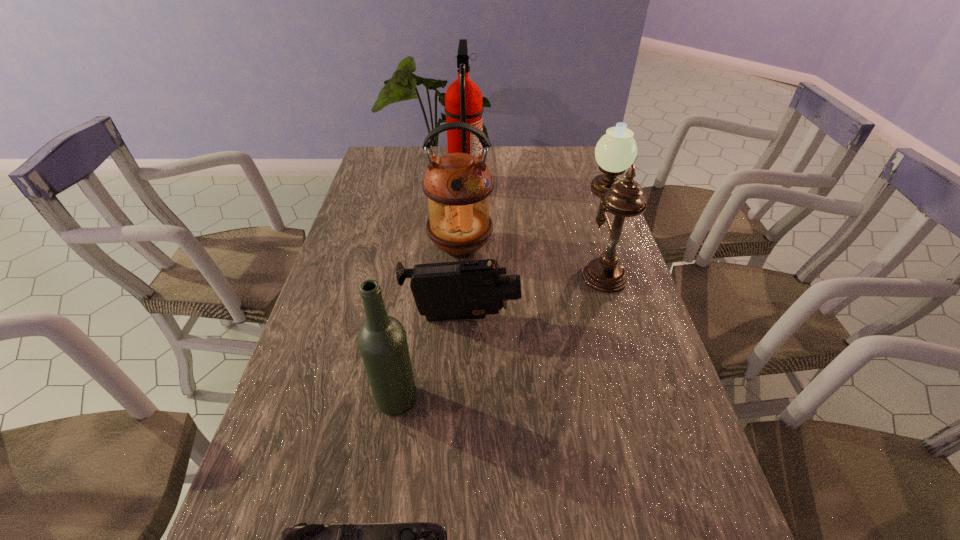
Find the location of a particular element. fire extinguisher is located at coordinates 463,100.

This screenshot has height=540, width=960. In order to click on the farthest object in this screenshot , I will do `click(463, 100)`.

Where is `the left oil lamp`? the left oil lamp is located at coordinates (458, 185).

The image size is (960, 540). Identify the location of the right oil lamp. [616, 151].

Where is `the second nearest object`? The width and height of the screenshot is (960, 540). the second nearest object is located at coordinates (382, 340).

What are the coordinates of `the farther camcorder` in the screenshot? It's located at (472, 289).

Find the location of `the third nearest object`. the third nearest object is located at coordinates (472, 289).

Locate an element on the screen. free location located 0.340m on the side of the tallest object near the handle is located at coordinates (575, 183).

The width and height of the screenshot is (960, 540). In order to click on free location located 0.060m on the front of the left oil lamp in this screenshot , I will do `click(459, 284)`.

Where is `free point located 0.100m on the front of the right oil lamp`? free point located 0.100m on the front of the right oil lamp is located at coordinates 617,320.